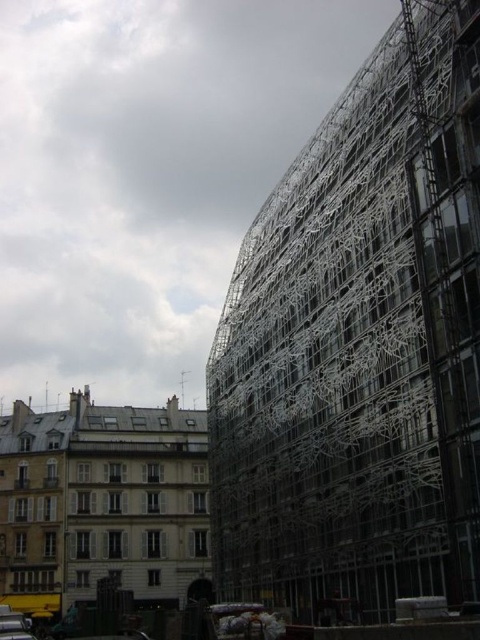
Question: Is metallic scaffolding at right positioned behind metallic silver car at lower left?

Choices:
 (A) yes
 (B) no

Answer: (B)

Question: Is metallic scaffolding at right wider than metallic silver car at lower left?

Choices:
 (A) yes
 (B) no

Answer: (A)

Question: Considering the relative positions of metallic scaffolding at right and metallic silver car at lower left in the image provided, where is metallic scaffolding at right located with respect to metallic silver car at lower left?

Choices:
 (A) above
 (B) below

Answer: (A)